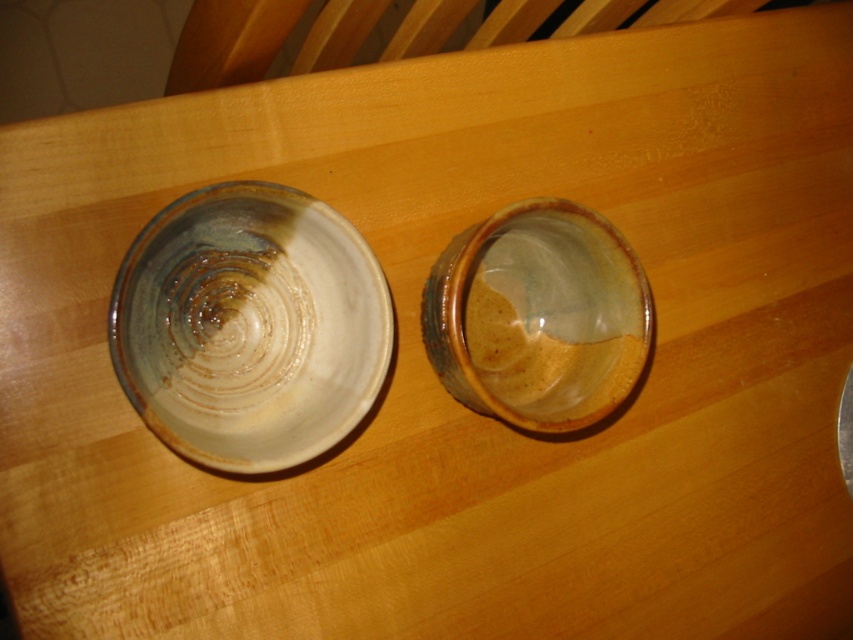
Question: Does matte ceramic bowl at left appear under matte ceramic bowl at center?

Choices:
 (A) yes
 (B) no

Answer: (A)

Question: Is matte ceramic bowl at left to the right of matte ceramic bowl at center from the viewer's perspective?

Choices:
 (A) no
 (B) yes

Answer: (A)

Question: Does matte ceramic bowl at left have a smaller size compared to matte ceramic bowl at center?

Choices:
 (A) no
 (B) yes

Answer: (A)

Question: Which of the following is the closest to the observer?

Choices:
 (A) (619, 371)
 (B) (244, 218)

Answer: (B)